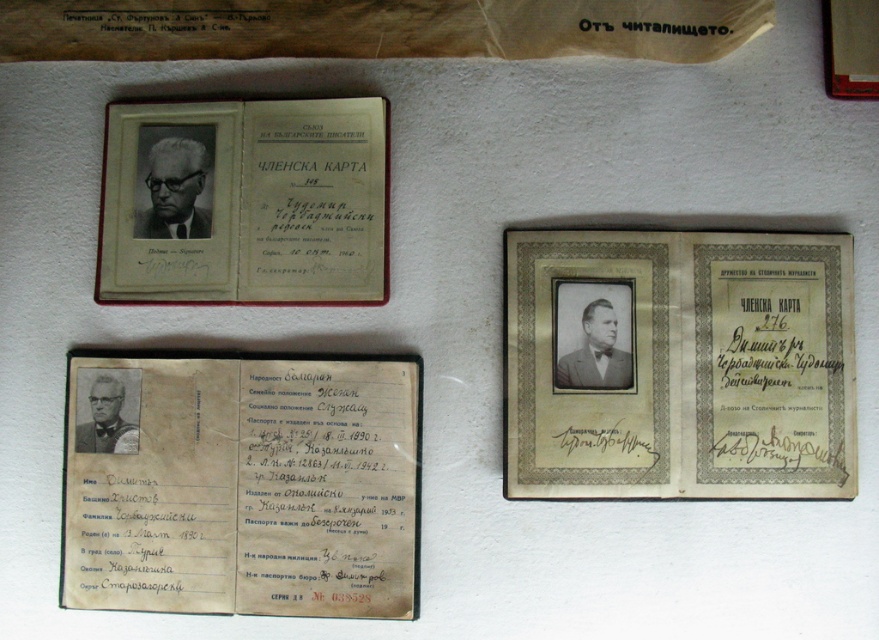
You are a historian trying to organize these documents. You need to place the gold textured paper at center and the yellowed paper passport at center into two separate folders. What is the minimum distance in centimeters you should keep between the two folders to ensure they don not overlap?

The gold textured paper at center and yellowed paper passport at center are 22.44 centimeters apart from each other, so you should keep at least 22.44 centimeters between the two folders to prevent overlapping.

You are organizing historical documents and need to place them in a display case. The case has a maximum width of 20 cm. The yellowed paper passport at center is 18 cm wide, and the matte paper membership card at upper left is 12 cm wide. Can both items fit side by side in the case without overlapping?

The yellowed paper passport at center is 18 cm wide and the matte paper membership card at upper left is 12 cm wide. Combined, their total width is 30 cm, which exceeds the case maximum width of 20 cm. Therefore, they cannot fit side by side without overlapping.

You are organizing a document restoration project and need to place the gold textured paper at center and the matte paper membership card at upper left into archival folders. Which document should you place to the left side of the archival folder?

The matte paper membership card at upper left should be placed to the left side of the archival folder because the gold textured paper at center is positioned on the right side of it in the original layout.